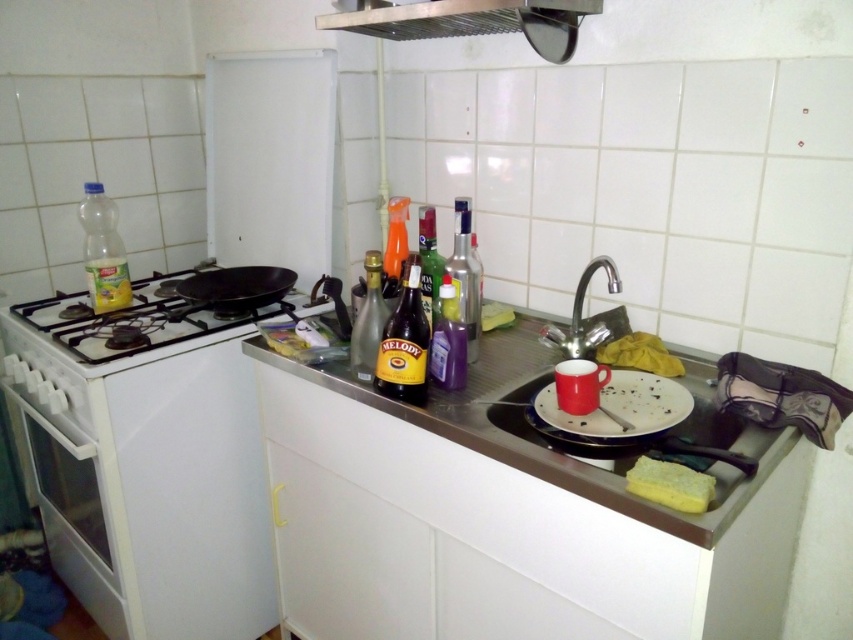
In the scene shown: Who is positioned more to the right, white matte drawer at center or purple glass bottle at center?

Positioned to the right is purple glass bottle at center.

What do you see at coordinates (347, 556) in the screenshot?
I see `white matte drawer at center` at bounding box center [347, 556].

Is point (303, 544) closer to camera compared to point (465, 234)?

No, it is behind (465, 234).

Image resolution: width=853 pixels, height=640 pixels. I want to click on white matte drawer at center, so click(x=347, y=556).

Can you confirm if black matte gas stove at left is taller than yellow matte bottle at center?

No, black matte gas stove at left is not taller than yellow matte bottle at center.

Which is below, black matte gas stove at left or yellow matte bottle at center?

yellow matte bottle at center is lower down.

What do you see at coordinates (163, 310) in the screenshot?
I see `black matte gas stove at left` at bounding box center [163, 310].

What are the coordinates of `black matte gas stove at left` in the screenshot? It's located at (163, 310).

Does black matte gas stove at left have a smaller size compared to satin silver exhaust hood at upper center?

Incorrect, black matte gas stove at left is not smaller in size than satin silver exhaust hood at upper center.

Does point (222, 323) come in front of point (585, 4)?

No, it is not.

Image resolution: width=853 pixels, height=640 pixels. I want to click on black matte gas stove at left, so pyautogui.click(x=163, y=310).